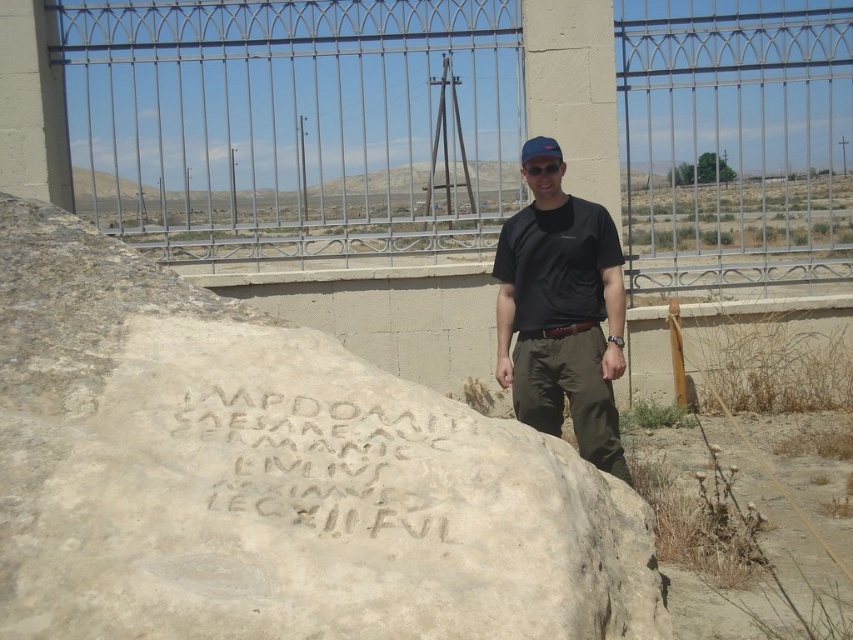
Question: Does light beige stone boulder at center appear over blue fabric baseball cap at center?

Choices:
 (A) yes
 (B) no

Answer: (B)

Question: Is brushed metal fence at upper center above carved stone inscription at center?

Choices:
 (A) yes
 (B) no

Answer: (A)

Question: Is the position of light beige stone boulder at center more distant than that of black matte shirt at center?

Choices:
 (A) no
 (B) yes

Answer: (A)

Question: Which of the following is the farthest from the observer?

Choices:
 (A) black matte shirt at center
 (B) brushed metal fence at upper center

Answer: (B)

Question: Estimate the real-world distances between objects in this image. Which object is closer to the blue fabric baseball cap at center?

Choices:
 (A) black matte shirt at center
 (B) carved stone inscription at center
 (C) light beige stone boulder at center
 (D) brushed metal fence at upper center

Answer: (A)

Question: Which point is farther to the camera?

Choices:
 (A) (343, 502)
 (B) (576, 368)

Answer: (B)